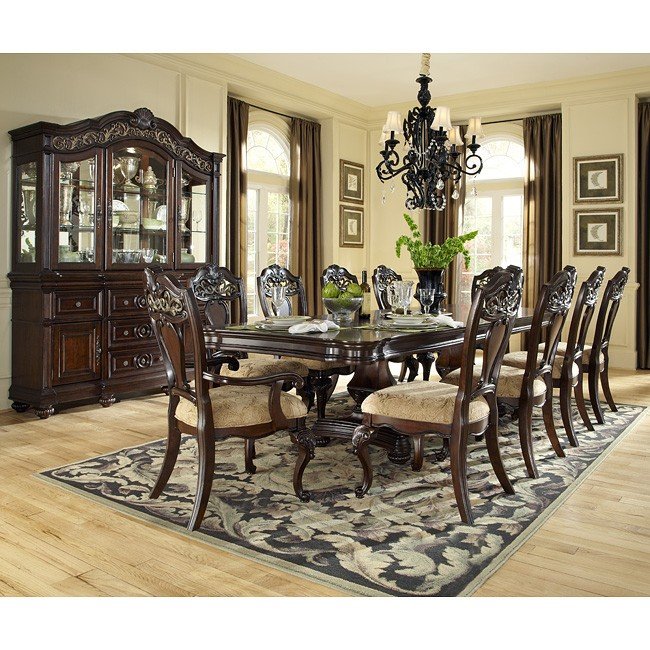
Where is `fully visible curtains`? Image resolution: width=650 pixels, height=650 pixels. fully visible curtains is located at coordinates (554, 203), (434, 214), (309, 222), (231, 214).